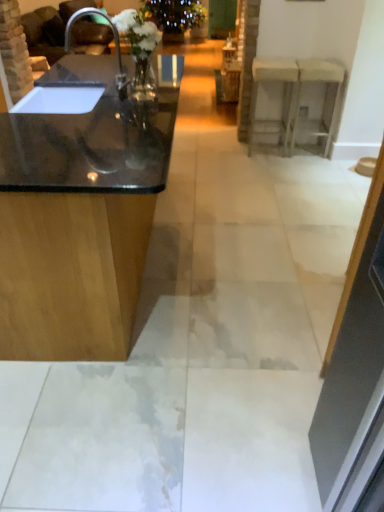
Locate an element on the screen. The width and height of the screenshot is (384, 512). black glossy countertop at left, the first counter viewed from the front is located at coordinates (80, 216).

What do you see at coordinates (221, 18) in the screenshot? The height and width of the screenshot is (512, 384). I see `transparent glass door at upper center` at bounding box center [221, 18].

Find the location of a particular element. black glossy countertop at left, the second counter in the right-to-left sequence is located at coordinates (80, 216).

Is white glossy counter at upper right, the 2th counter when ordered from front to back, looking in the opposite direction of matte black sink at left?

white glossy counter at upper right, the 2th counter when ordered from front to back, is not turned away from matte black sink at left.

How different are the orientations of white glossy counter at upper right, the 1th counter in the back-to-front sequence, and matte black sink at left in degrees?

88.5 degrees separate the facing orientations of white glossy counter at upper right, the 1th counter in the back-to-front sequence, and matte black sink at left.

Does white glossy counter at upper right, the 1th counter in the back-to-front sequence, come in front of matte black sink at left?

No, the depth of white glossy counter at upper right, the 1th counter in the back-to-front sequence, is greater than that of matte black sink at left.

From a real-world perspective, is white glossy counter at upper right, the 1th counter in the back-to-front sequence, physically located above or below matte black sink at left?

white glossy counter at upper right, the 1th counter in the back-to-front sequence, is below matte black sink at left.

I want to click on counter located below the matte black sink at left (from the image's perspective), so click(80, 216).

Looking at this image, is black glossy countertop at left, the 2th counter viewed from the back, positioned behind matte black sink at left?

No, it is in front of matte black sink at left.

How distant is black glossy countertop at left, arranged as the 1th counter when viewed from the left, from matte black sink at left?

black glossy countertop at left, arranged as the 1th counter when viewed from the left, is 7.79 feet from matte black sink at left.

Can you confirm if black glossy countertop at left, arranged as the 1th counter when viewed from the left, is positioned to the left of matte black sink at left?

In fact, black glossy countertop at left, arranged as the 1th counter when viewed from the left, is to the right of matte black sink at left.

Which is behind, point (233, 29) or point (282, 58)?

The point (233, 29) is farther from the camera.

Considering the relative positions of transparent glass door at upper center and white glossy counter at upper right, the 2th counter when ordered from front to back, in the image provided, is transparent glass door at upper center to the left or to the right of white glossy counter at upper right, the 2th counter when ordered from front to back,?

Based on their positions, transparent glass door at upper center is located to the left of white glossy counter at upper right, the 2th counter when ordered from front to back.

Is transparent glass door at upper center outside of white glossy counter at upper right, the 1th counter in the back-to-front sequence?

Absolutely, transparent glass door at upper center is external to white glossy counter at upper right, the 1th counter in the back-to-front sequence.

Considering the sizes of objects transparent glass door at upper center and matte black sink at left in the image provided, who is bigger, transparent glass door at upper center or matte black sink at left?

With larger size is transparent glass door at upper center.

Can you tell me how much transparent glass door at upper center and matte black sink at left differ in facing direction?

transparent glass door at upper center and matte black sink at left are facing 90.1 degrees away from each other.

In the image, there is a transparent glass door at upper center. Identify the location of sink below it (from the image's perspective). Image resolution: width=384 pixels, height=512 pixels. (88, 15).

From their relative heights in the image, would you say transparent glass door at upper center is taller or shorter than matte black sink at left?

Considering their sizes, transparent glass door at upper center has more height than matte black sink at left.

Does point (298, 106) appear closer or farther from the camera than point (114, 135)?

Clearly, point (298, 106) is more distant from the camera than point (114, 135).

From a real-world perspective, is white glossy counter at upper right, the 1th counter in the back-to-front sequence, physically above black glossy countertop at left, the 2th counter viewed from the back?

Actually, white glossy counter at upper right, the 1th counter in the back-to-front sequence, is physically below black glossy countertop at left, the 2th counter viewed from the back, in the real world.

Between white glossy counter at upper right, the 1th counter viewed from the right, and black glossy countertop at left, the second counter in the right-to-left sequence, which one has larger width?

black glossy countertop at left, the second counter in the right-to-left sequence.

Which is correct: white glossy counter at upper right, the 2th counter when ordered from front to back, is inside black glossy countertop at left, arranged as the 1th counter when viewed from the left, or outside of it?

white glossy counter at upper right, the 2th counter when ordered from front to back, cannot be found inside black glossy countertop at left, arranged as the 1th counter when viewed from the left.

Who is shorter, black glossy countertop at left, arranged as the 1th counter when viewed from the left, or white glossy counter at upper right, the 2th counter when ordered from front to back?

white glossy counter at upper right, the 2th counter when ordered from front to back, is shorter.

Does black glossy countertop at left, the second counter in the right-to-left sequence, come in front of white glossy counter at upper right, the 1th counter in the back-to-front sequence?

Yes.

At what (x,y) coordinates should I click in order to perform the action: click on counter that is on the right side of black glossy countertop at left, the 2th counter viewed from the back. Please return your answer as a coordinate pair (x, y). Looking at the image, I should click on (296, 98).

How many degrees apart are the facing directions of black glossy countertop at left, arranged as the 1th counter when viewed from the left, and white glossy counter at upper right, which is the 2th counter from left to right?

The angular difference between black glossy countertop at left, arranged as the 1th counter when viewed from the left, and white glossy counter at upper right, which is the 2th counter from left to right, is 93.2 degrees.

Can you confirm if matte black sink at left is smaller than white glossy counter at upper right, the 1th counter viewed from the right?

No, matte black sink at left is not smaller than white glossy counter at upper right, the 1th counter viewed from the right.

Is matte black sink at left not inside white glossy counter at upper right, the 2th counter when ordered from front to back?

matte black sink at left is positioned outside white glossy counter at upper right, the 2th counter when ordered from front to back.

From a real-world perspective, count 2nd counters downward from the matte black sink at left and point to it. Please provide its 2D coordinates.

[(296, 98)]

Is matte black sink at left to the right of white glossy counter at upper right, the 1th counter in the back-to-front sequence, from the viewer's perspective?

Incorrect, matte black sink at left is not on the right side of white glossy counter at upper right, the 1th counter in the back-to-front sequence.

Where is `sink in front of the white glossy counter at upper right, the 1th counter in the back-to-front sequence`? sink in front of the white glossy counter at upper right, the 1th counter in the back-to-front sequence is located at coordinates (88, 15).

The height and width of the screenshot is (512, 384). In order to click on counter below the matte black sink at left (from the image's perspective) in this screenshot , I will do `click(80, 216)`.

Which object lies nearer to the anchor point transparent glass door at upper center, white glossy counter at upper right, the 1th counter in the back-to-front sequence, or matte black sink at left?

matte black sink at left is positioned closer to the anchor transparent glass door at upper center.

Which object lies nearer to the anchor point black glossy countertop at left, the first counter viewed from the front, matte black sink at left or transparent glass door at upper center?

matte black sink at left.

From the image, which object appears to be nearer to matte black sink at left, black glossy countertop at left, the 2th counter viewed from the back, or transparent glass door at upper center?

The object closer to matte black sink at left is black glossy countertop at left, the 2th counter viewed from the back.

When comparing their distances from white glossy counter at upper right, the 1th counter viewed from the right, does matte black sink at left or black glossy countertop at left, the second counter in the right-to-left sequence, seem closer?

Based on the image, black glossy countertop at left, the second counter in the right-to-left sequence, appears to be nearer to white glossy counter at upper right, the 1th counter viewed from the right.

When comparing their distances from transparent glass door at upper center, does matte black sink at left or white glossy counter at upper right, the 2th counter when ordered from front to back, seem further?

Based on the image, white glossy counter at upper right, the 2th counter when ordered from front to back, appears to be further to transparent glass door at upper center.

When comparing their distances from matte black sink at left, does white glossy counter at upper right, the 1th counter viewed from the right, or black glossy countertop at left, the first counter viewed from the front, seem further?

Among the two, black glossy countertop at left, the first counter viewed from the front, is located further to matte black sink at left.

In the scene shown: Looking at the image, which one is located further to white glossy counter at upper right, the 1th counter in the back-to-front sequence, black glossy countertop at left, the second counter in the right-to-left sequence, or matte black sink at left?

matte black sink at left.

When comparing their distances from transparent glass door at upper center, does black glossy countertop at left, the first counter viewed from the front, or matte black sink at left seem further?

black glossy countertop at left, the first counter viewed from the front, is positioned further to the anchor transparent glass door at upper center.

Find the location of a particular element. This screenshot has height=512, width=384. counter positioned between black glossy countertop at left, the 2th counter viewed from the back, and transparent glass door at upper center from near to far is located at coordinates (296, 98).

Image resolution: width=384 pixels, height=512 pixels. I want to click on counter located between matte black sink at left and transparent glass door at upper center in the depth direction, so click(x=296, y=98).

Find the location of `sink located between black glossy countertop at left, the second counter in the right-to-left sequence, and white glossy counter at upper right, the 1th counter viewed from the right, in the depth direction`. sink located between black glossy countertop at left, the second counter in the right-to-left sequence, and white glossy counter at upper right, the 1th counter viewed from the right, in the depth direction is located at coordinates (88, 15).

Identify the location of sink between black glossy countertop at left, the first counter viewed from the front, and transparent glass door at upper center, along the z-axis. This screenshot has width=384, height=512. (88, 15).